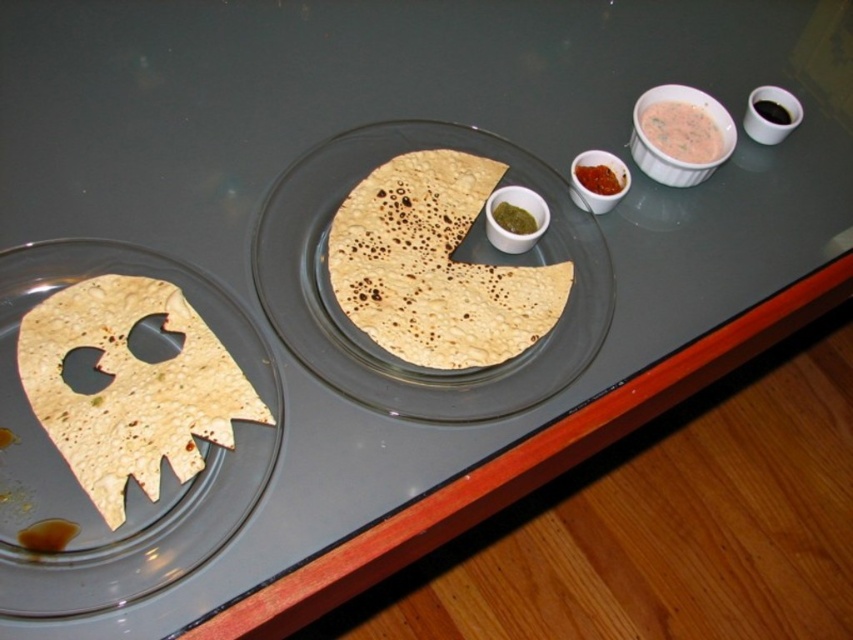
You are a food stylist arranging items on a table. You have a brown matte flatbread at center and a white creamy dip at upper right. According to the scene, where should you place the brown matte flatbread relative to the white creamy dip?

The brown matte flatbread at center should be placed to the left of the white creamy dip at upper right as per the scene description.

You are looking at the two points on the table setup. Which point is closer to you, point [525,292] or point [671,118]?

Point [525,292] is closer to the viewer than point [671,118].